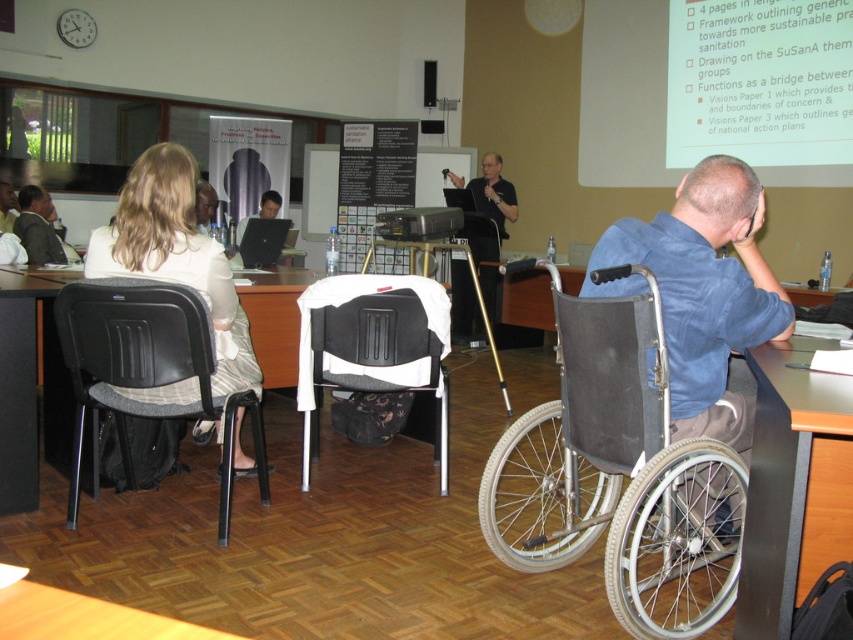
Looking at this image, does silver metallic wheelchair at right have a greater width compared to blue denim shirt at center?

Yes.

Is the position of silver metallic wheelchair at right more distant than that of blue denim shirt at center?

No.

This screenshot has width=853, height=640. What are the coordinates of `silver metallic wheelchair at right` in the screenshot? It's located at (618, 474).

Locate an element on the screen. Image resolution: width=853 pixels, height=640 pixels. silver metallic wheelchair at right is located at coordinates (618, 474).

Based on the photo, measure the distance between silver metallic wheelchair at right and camera.

silver metallic wheelchair at right and camera are 1.72 meters apart from each other.

Who is lower down, silver metallic wheelchair at right or dark suit jacket at left?

Positioned lower is silver metallic wheelchair at right.

Is point (711, 509) closer to camera compared to point (47, 236)?

Yes, point (711, 509) is in front of point (47, 236).

This screenshot has width=853, height=640. What are the coordinates of `silver metallic wheelchair at right` in the screenshot? It's located at (618, 474).

The width and height of the screenshot is (853, 640). What do you see at coordinates (141, 362) in the screenshot? I see `black plastic chair at left` at bounding box center [141, 362].

Where is `black plastic chair at left`? black plastic chair at left is located at coordinates (141, 362).